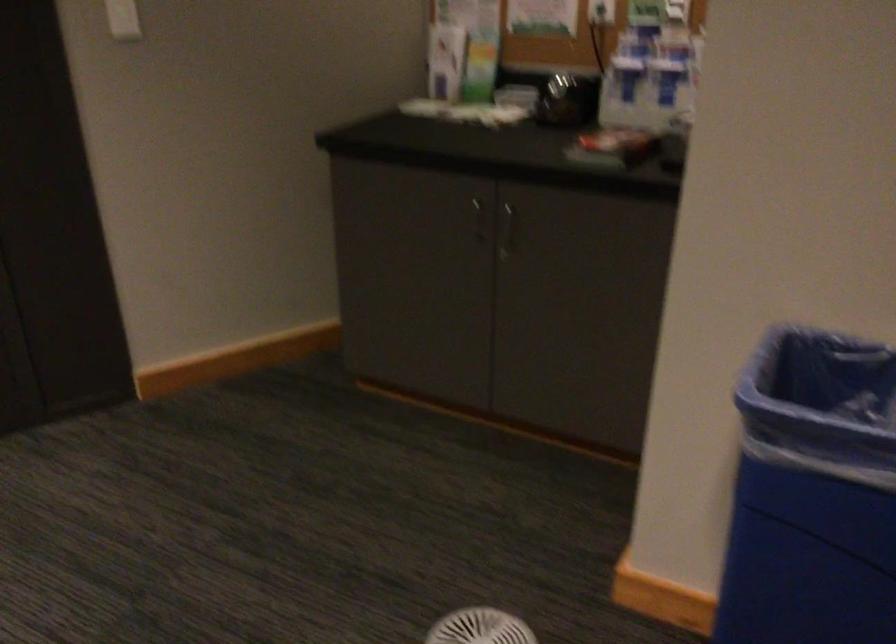
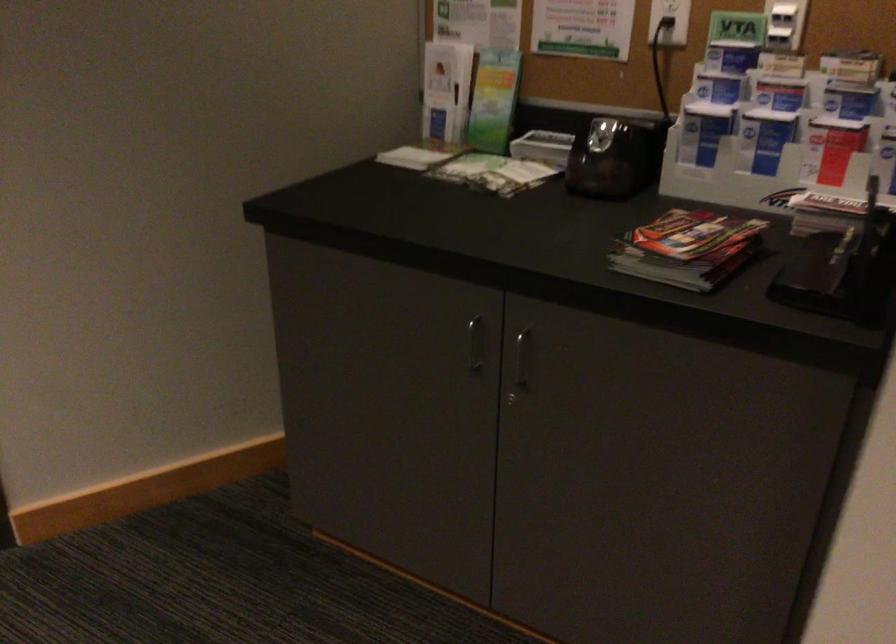
The point at (567, 96) is marked in the first image. Where is the corresponding point in the second image?

(613, 158)